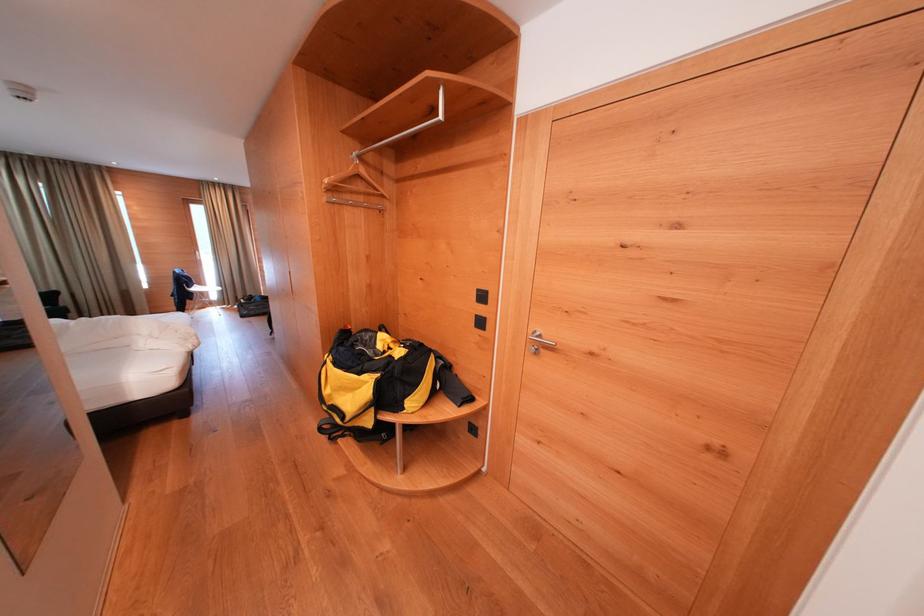
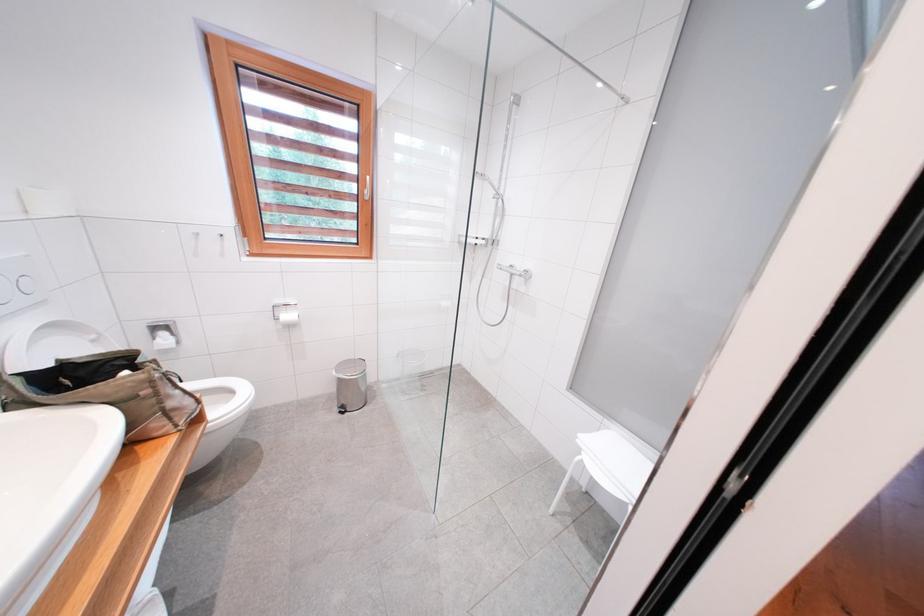
How did the camera likely rotate?

The rotation direction of the camera is left-down.